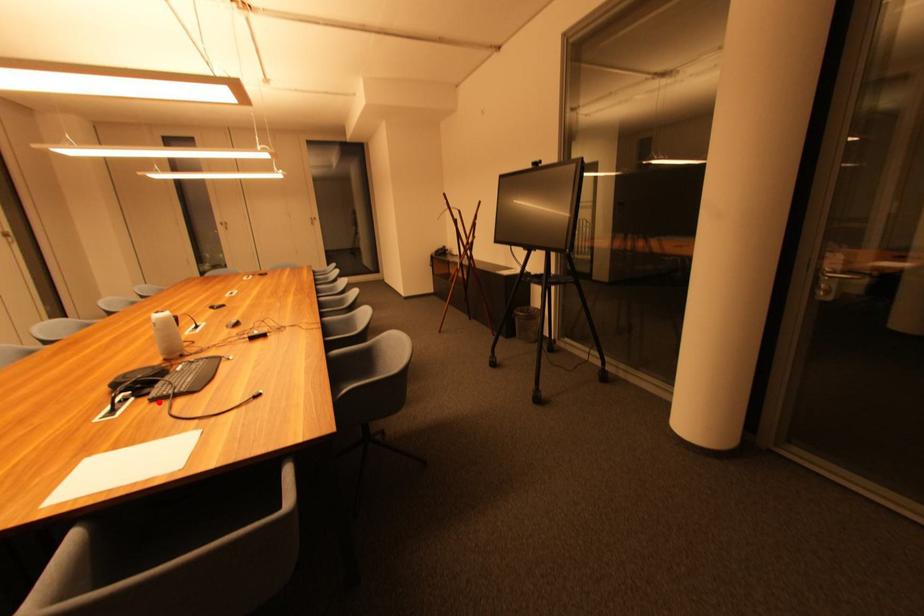
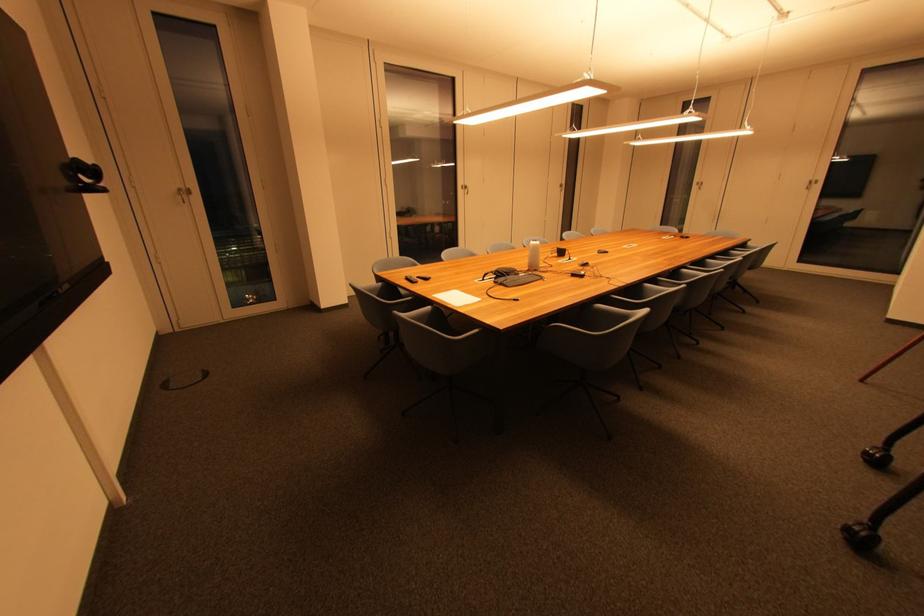
The point at the highlighted location is marked in the first image. Where is the corresponding point in the second image?

(500, 285)